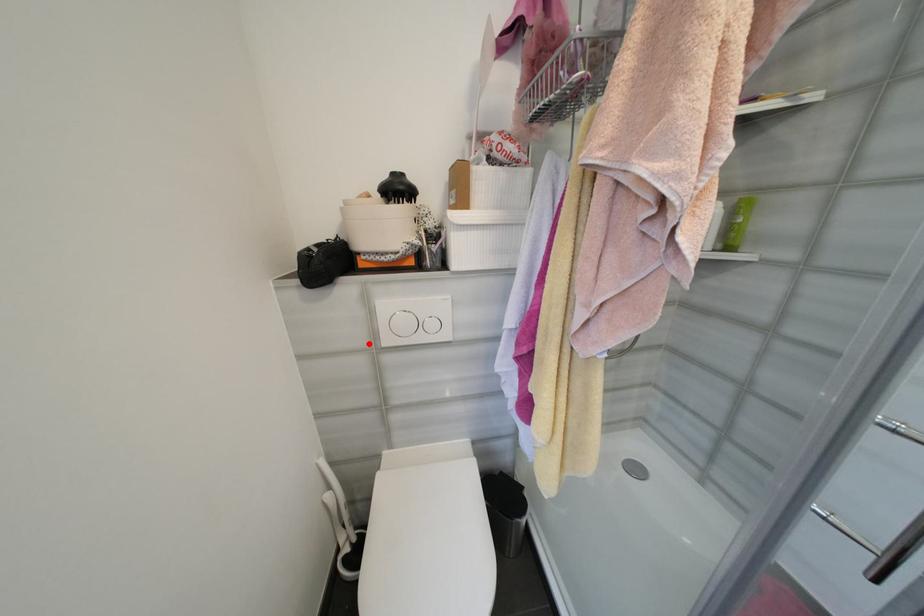
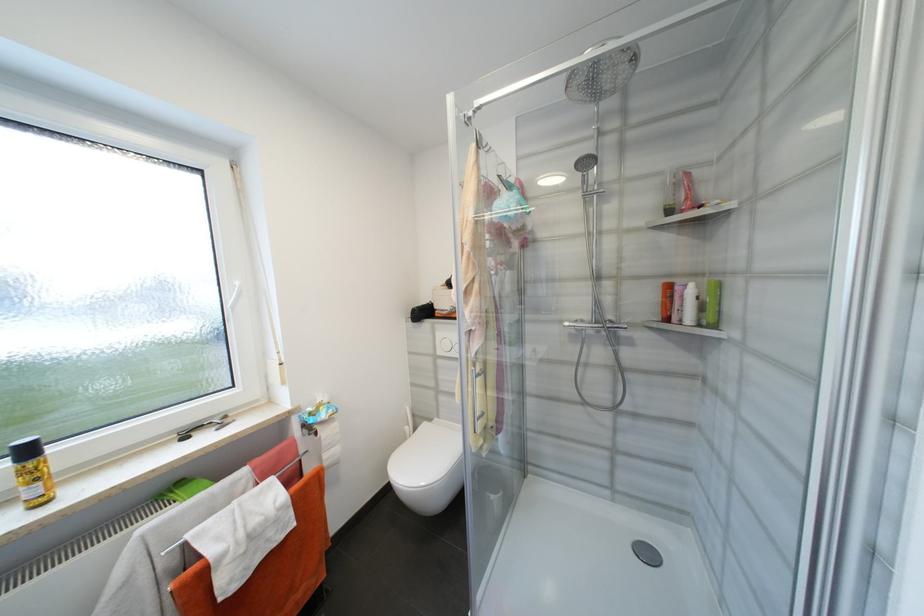
Question: I am providing you with two images of the same scene from different viewpoints. Given a red point in image1, look at the same physical point in image2. Is it:

Choices:
 (A) Closer to the viewpoint
 (B) Farther from the viewpoint

Answer: (B)